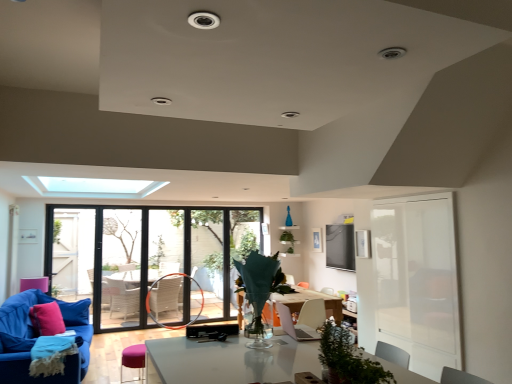
Describe the element at coordinates (153, 260) in the screenshot. I see `clear glass window at center` at that location.

The height and width of the screenshot is (384, 512). Describe the element at coordinates (133, 360) in the screenshot. I see `purple fabric stool at lower left` at that location.

Where is `green matte plant at center`? green matte plant at center is located at coordinates (288, 240).

Consider the image. Is clear glass window at center facing away from pink fabric pillow at lower left?

No, clear glass window at center is not facing the opposite direction of pink fabric pillow at lower left.

From the image's perspective, which is above, clear glass window at center or pink fabric pillow at lower left?

From the image's view, clear glass window at center is above.

This screenshot has height=384, width=512. Identify the location of pillow below the clear glass window at center (from the image's perspective). (47, 319).

Considering the relative sizes of clear glass window at center and pink fabric pillow at lower left in the image provided, is clear glass window at center taller than pink fabric pillow at lower left?

Indeed, clear glass window at center has a greater height compared to pink fabric pillow at lower left.

Is green matte plant at center located outside clear glass window at center?

Yes, green matte plant at center is outside of clear glass window at center.

Which object is wider, green matte plant at center or clear glass window at center?

green matte plant at center.

From the image's perspective, is green matte plant at center positioned above or below clear glass window at center?

Clearly, from the image's perspective, green matte plant at center is above clear glass window at center.

Between velvet blue couch at lower left and purple fabric stool at lower left, which one has less height?

purple fabric stool at lower left is shorter.

Looking at this image, is velvet blue couch at lower left positioned with its back to purple fabric stool at lower left?

velvet blue couch at lower left does not have its back to purple fabric stool at lower left.

The width and height of the screenshot is (512, 384). I want to click on stool behind the velvet blue couch at lower left, so click(133, 360).

Is velvet blue couch at lower left far from purple fabric stool at lower left?

That's not correct — velvet blue couch at lower left is a little close to purple fabric stool at lower left.

Looking at this image, considering the relative sizes of pink fabric pillow at lower left and green matte plant at center in the image provided, is pink fabric pillow at lower left bigger than green matte plant at center?

No, pink fabric pillow at lower left is not bigger than green matte plant at center.

Between pink fabric pillow at lower left and green matte plant at center, which one has smaller width?

Thinner between the two is pink fabric pillow at lower left.

At what (x,y) coordinates should I click in order to perform the action: click on pillow in front of the green matte plant at center. Please return your answer as a coordinate pair (x, y). Image resolution: width=512 pixels, height=384 pixels. Looking at the image, I should click on (47, 319).

Is velvet blue couch at lower left taller than clear glass window at center?

No.

Based on the photo, is velvet blue couch at lower left wider or thinner than clear glass window at center?

velvet blue couch at lower left is wider than clear glass window at center.

Is velvet blue couch at lower left oriented away from clear glass window at center?

velvet blue couch at lower left does not have its back to clear glass window at center.

Who is bigger, velvet blue couch at lower left or clear glass window at center?

Bigger between the two is velvet blue couch at lower left.

Which of these two, velvet blue couch at lower left or white translucent screen door at right, is bigger?

velvet blue couch at lower left is bigger.

How much distance is there between velvet blue couch at lower left and white translucent screen door at right?

3.15 meters.

Which is in front, point (9, 350) or point (421, 373)?

The point (421, 373) is in front.

From a real-world perspective, is pink fabric pillow at lower left above or below white translucent screen door at right?

pink fabric pillow at lower left is below white translucent screen door at right.

Is pink fabric pillow at lower left positioned beyond the bounds of white translucent screen door at right?

Yes, pink fabric pillow at lower left is not within white translucent screen door at right.

Considering the positions of objects pink fabric pillow at lower left and white translucent screen door at right in the image provided, who is more to the right, pink fabric pillow at lower left or white translucent screen door at right?

white translucent screen door at right is more to the right.

Would you say pink fabric pillow at lower left is a long distance from white translucent screen door at right?

pink fabric pillow at lower left is positioned a significant distance from white translucent screen door at right.

Identify the location of window behind the pink fabric pillow at lower left. Image resolution: width=512 pixels, height=384 pixels. (153, 260).

In order to click on window below the green matte plant at center (from the image's perspective) in this screenshot , I will do `click(153, 260)`.

Which object lies nearer to the anchor point white translucent screen door at right, pink fabric pillow at lower left or green matte plant at center?

green matte plant at center.

Considering their positions, is green matte plant at center positioned closer to velvet blue couch at lower left than white translucent screen door at right?

Based on the image, white translucent screen door at right appears to be nearer to velvet blue couch at lower left.

Considering their positions, is pink fabric pillow at lower left positioned closer to purple fabric stool at lower left than velvet blue couch at lower left?

velvet blue couch at lower left is closer to purple fabric stool at lower left.

Based on the photo, from the image, which object appears to be nearer to green matte plant at center, velvet blue couch at lower left or pink fabric pillow at lower left?

pink fabric pillow at lower left lies closer to green matte plant at center than the other object.

From the image, which object appears to be farther from white translucent screen door at right, clear glass window at center or purple fabric stool at lower left?

Among the two, clear glass window at center is located further to white translucent screen door at right.

Looking at the image, which one is located further to clear glass window at center, pink fabric pillow at lower left or purple fabric stool at lower left?

purple fabric stool at lower left.

Based on their spatial positions, is clear glass window at center or white translucent screen door at right closer to velvet blue couch at lower left?

clear glass window at center is positioned closer to the anchor velvet blue couch at lower left.

Based on their spatial positions, is purple fabric stool at lower left or clear glass window at center closer to white translucent screen door at right?

purple fabric stool at lower left is closer to white translucent screen door at right.

The width and height of the screenshot is (512, 384). What are the coordinates of `stool between velvet blue couch at lower left and pink fabric pillow at lower left in the front-back direction` in the screenshot? It's located at (133, 360).

At what (x,y) coordinates should I click in order to perform the action: click on pillow between velvet blue couch at lower left and clear glass window at center from front to back. Please return your answer as a coordinate pair (x, y). This screenshot has height=384, width=512. Looking at the image, I should click on (47, 319).

The width and height of the screenshot is (512, 384). I want to click on stool located between velvet blue couch at lower left and white translucent screen door at right in the left-right direction, so click(x=133, y=360).

Find the location of a particular element. studio couch located between white translucent screen door at right and green matte plant at center in the depth direction is located at coordinates (36, 338).